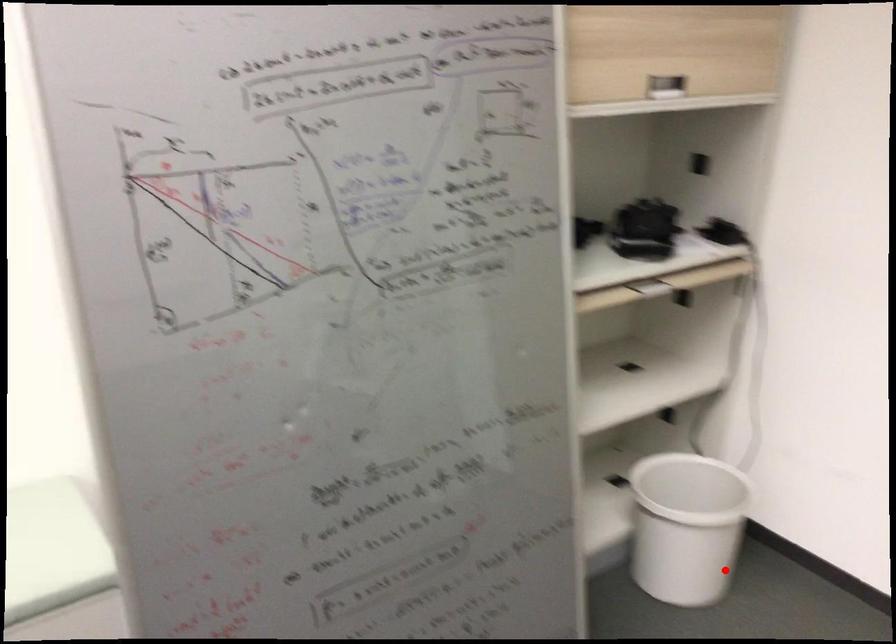
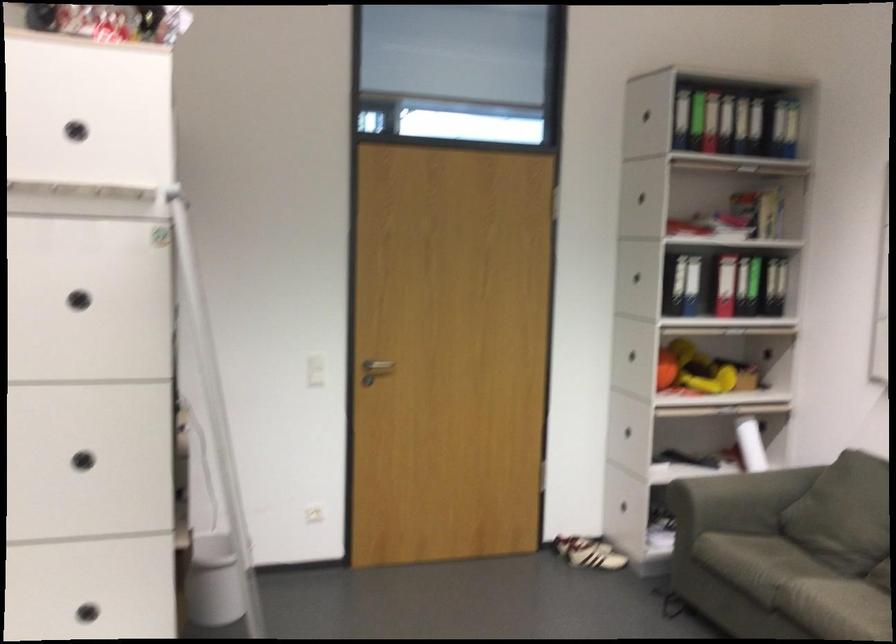
Question: I am providing you with two images of the same scene from different viewpoints. In image1, a red point is highlighted. Considering the same 3D point in image2, which of the following is correct?

Choices:
 (A) It is closer
 (B) It is farther

Answer: (B)